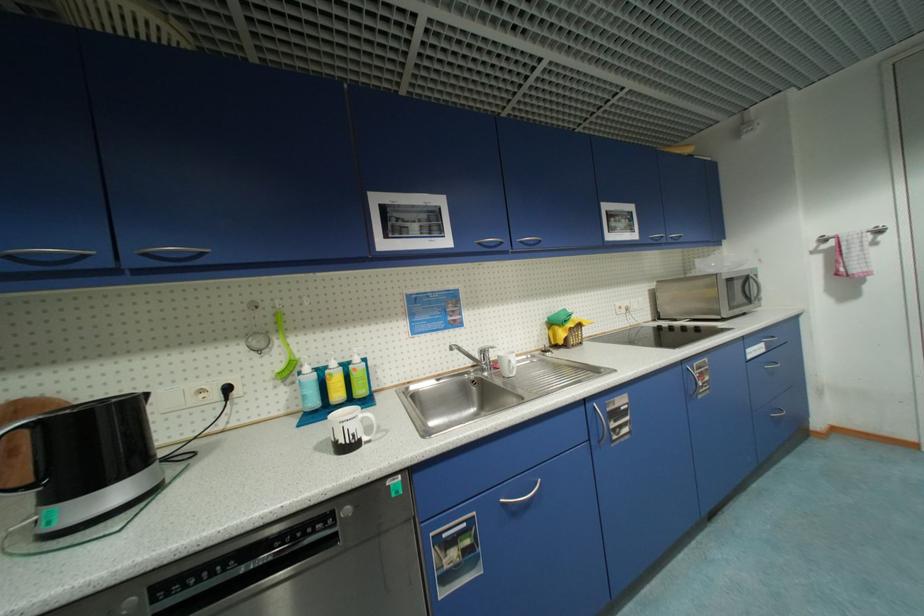
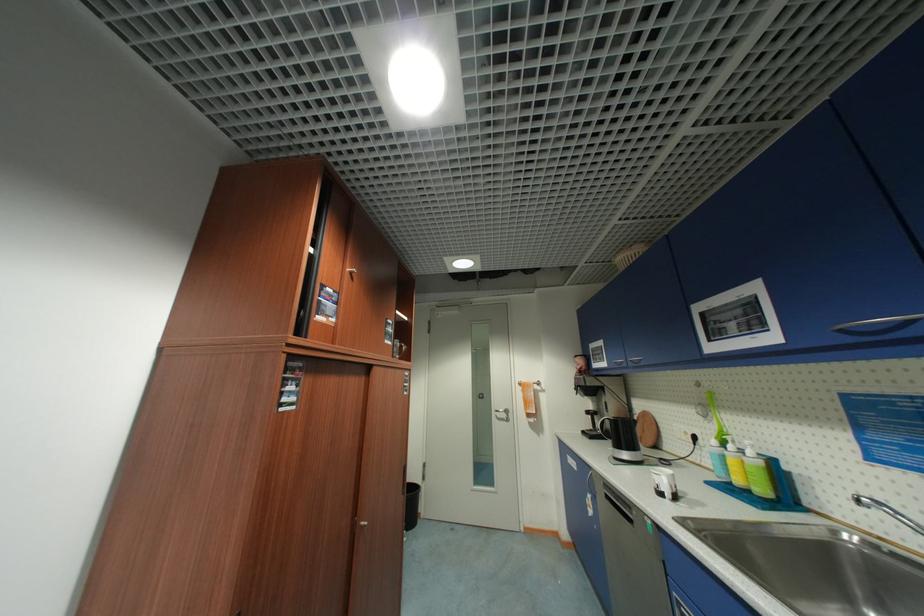
Where in the second image is the point corresponding to (x=362, y=360) from the first image?

(756, 454)